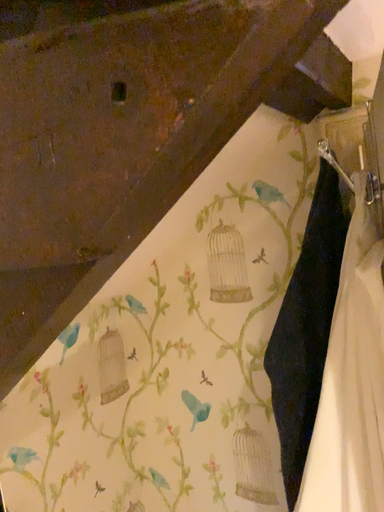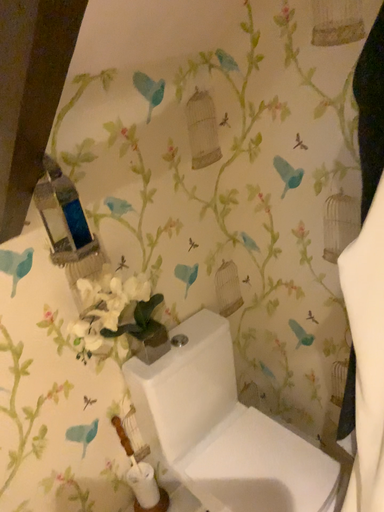
Question: How did the camera likely rotate when shooting the video?

Choices:
 (A) rotated right
 (B) rotated left

Answer: (B)